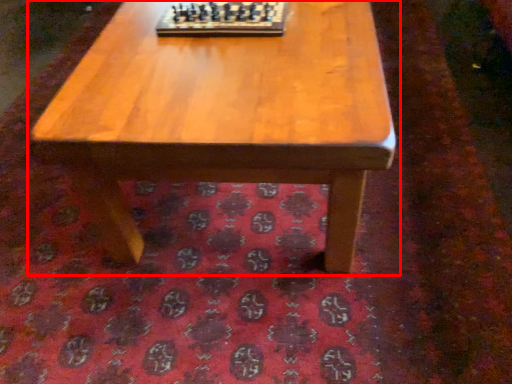
Question: From the image's perspective, considering the relative positions of coffee table (annotated by the red box) and board game in the image provided, where is coffee table (annotated by the red box) located with respect to the staircase?

Choices:
 (A) above
 (B) below

Answer: (B)